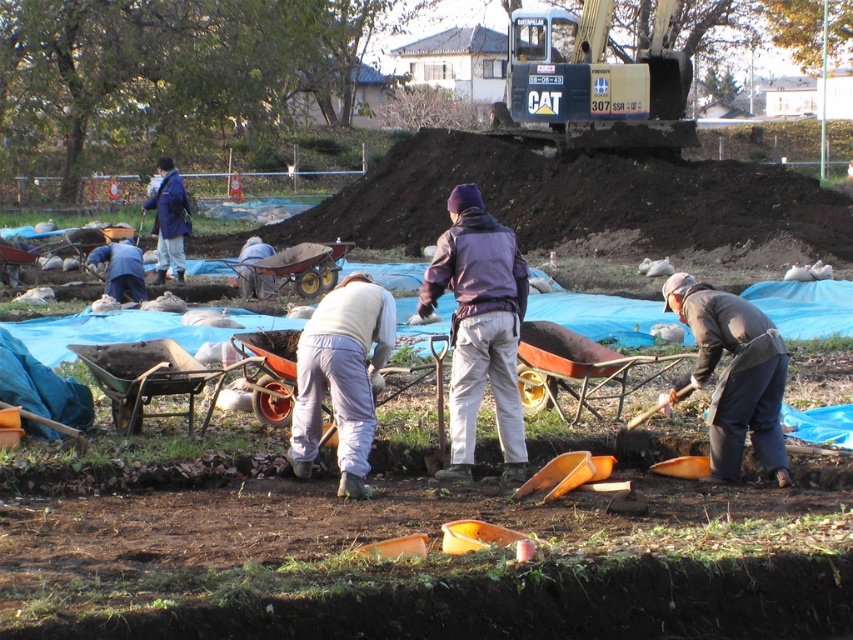
Question: Is orange plastic wheelbarrow at center to the right of light gray fabric pants at center from the viewer's perspective?

Choices:
 (A) yes
 (B) no

Answer: (A)

Question: Estimate the real-world distances between objects in this image. Which object is farther from the orange rubber wheelbarrow at center?

Choices:
 (A) brown fabric at lower right
 (B) dark brown soil at upper center
 (C) metallic orange wheelbarrow at center-left

Answer: (A)

Question: Does gray cotton pants at center lie behind orange plastic wheelbarrow at center?

Choices:
 (A) yes
 (B) no

Answer: (B)

Question: Can you confirm if purple fabric jacket at center is wider than gray cotton pants at center?

Choices:
 (A) no
 (B) yes

Answer: (A)

Question: Among these objects, which one is nearest to the camera?

Choices:
 (A) blue fabric jacket at upper left
 (B) brown fabric at lower right

Answer: (B)

Question: Which point is closer to the camera?

Choices:
 (A) dark brown soil at upper center
 (B) blue fabric jacket at upper left
 (C) orange rubber wheelbarrow at center
 (D) brown fabric at lower right

Answer: (D)